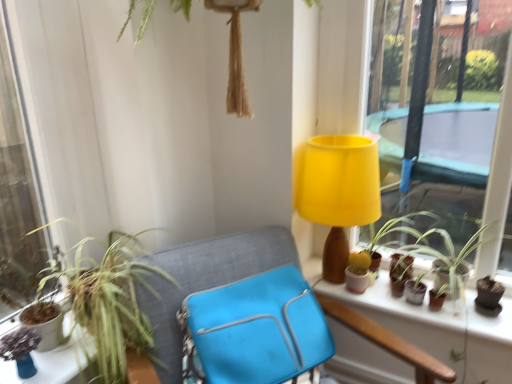
This screenshot has width=512, height=384. What do you see at coordinates (431, 250) in the screenshot? I see `green matte plant at right, the 1th houseplant positioned from the right` at bounding box center [431, 250].

Find the location of a particular element. The image size is (512, 384). matte green plant at lower left is located at coordinates (54, 362).

Image resolution: width=512 pixels, height=384 pixels. I want to click on matte brown flowerpot at right, which is the first flowerpot from right to left, so click(x=401, y=267).

What do you see at coordinates (339, 192) in the screenshot? The height and width of the screenshot is (384, 512). I see `yellow fabric lampshade at upper center` at bounding box center [339, 192].

Describe the element at coordinates (206, 280) in the screenshot. The height and width of the screenshot is (384, 512). I see `blue fabric bag at center` at that location.

Identify the location of blue fabric folding chair at center. This screenshot has height=384, width=512. (254, 330).

Find the location of `folding chair above the matte brown window sill at upper right (from a real-world perspective)`. folding chair above the matte brown window sill at upper right (from a real-world perspective) is located at coordinates (254, 330).

Which of these two, matte brown window sill at upper right or blue fabric folding chair at center, is bigger?

With larger size is blue fabric folding chair at center.

From a real-world perspective, does matte brown window sill at upper right stand above blue fabric folding chair at center?

No, from a real-world perspective, matte brown window sill at upper right is not above blue fabric folding chair at center.

Which of these two, matte brown window sill at upper right or blue fabric folding chair at center, stands taller?

blue fabric folding chair at center.

Is matte brown flowerpot at right, the 2th flowerpot from the left, wider than matte brown window sill at upper right?

In fact, matte brown flowerpot at right, the 2th flowerpot from the left, might be narrower than matte brown window sill at upper right.

From the image's perspective, is matte brown flowerpot at right, which is the first flowerpot from right to left, on top of matte brown window sill at upper right?

Yes, from the image's perspective, matte brown flowerpot at right, which is the first flowerpot from right to left, is above matte brown window sill at upper right.

Can you tell me how much matte brown flowerpot at right, which is the first flowerpot from right to left, and matte brown window sill at upper right differ in facing direction?

0.21 degrees separate the facing orientations of matte brown flowerpot at right, which is the first flowerpot from right to left, and matte brown window sill at upper right.

Considering the positions of point (394, 262) and point (438, 341), is point (394, 262) closer or farther from the camera than point (438, 341)?

Point (394, 262).

From a real-world perspective, is green leafy plant at left, placed as the 1th houseplant when sorted from left to right, above or below green matte plant at right, the 2th houseplant positioned from the left?

green leafy plant at left, placed as the 1th houseplant when sorted from left to right, is above green matte plant at right, the 2th houseplant positioned from the left.

Is the surface of green leafy plant at left, which is the second houseplant from right to left, in direct contact with green matte plant at right, the 2th houseplant positioned from the left?

They are not placed beside each other.

Is green leafy plant at left, which is the second houseplant from right to left, at the right side of green matte plant at right, the 1th houseplant positioned from the right?

No, green leafy plant at left, which is the second houseplant from right to left, is not to the right of green matte plant at right, the 1th houseplant positioned from the right.

The width and height of the screenshot is (512, 384). Find the location of `houseplant that is above the green matte plant at right, the 2th houseplant positioned from the left (from the image's perspective)`. houseplant that is above the green matte plant at right, the 2th houseplant positioned from the left (from the image's perspective) is located at coordinates (111, 301).

Is green leafy plant at left, placed as the 1th houseplant when sorted from left to right, next to matte white flowerpot at right, which is the first flowerpot in left-to-right order, and touching it?

No, green leafy plant at left, placed as the 1th houseplant when sorted from left to right, is not beside matte white flowerpot at right, which is the first flowerpot in left-to-right order.

From the image's perspective, does green leafy plant at left, which is the second houseplant from right to left, appear higher than matte white flowerpot at right, the 2th flowerpot when ordered from right to left?

Incorrect, from the image's perspective, green leafy plant at left, which is the second houseplant from right to left, is lower than matte white flowerpot at right, the 2th flowerpot when ordered from right to left.

Consider the image. Is green leafy plant at left, which is the second houseplant from right to left, in front of or behind matte white flowerpot at right, the 2th flowerpot when ordered from right to left, in the image?

In the image, green leafy plant at left, which is the second houseplant from right to left, appears in front of matte white flowerpot at right, the 2th flowerpot when ordered from right to left.

Would you say matte white flowerpot at right, which is the first flowerpot in left-to-right order, is part of green leafy plant at left, placed as the 1th houseplant when sorted from left to right,'s contents?

No, matte white flowerpot at right, which is the first flowerpot in left-to-right order, is not a part of green leafy plant at left, placed as the 1th houseplant when sorted from left to right.

Does matte brown window sill at upper right lie behind blue fabric bag at center?

Yes, matte brown window sill at upper right is behind blue fabric bag at center.

Between matte brown window sill at upper right and blue fabric bag at center, which one has larger width?

blue fabric bag at center is wider.

Is matte brown window sill at upper right shorter than blue fabric bag at center?

Yes, matte brown window sill at upper right is shorter than blue fabric bag at center.

Does point (359, 303) appear closer or farther from the camera than point (195, 276)?

Point (359, 303) appears to be farther away from the viewer than point (195, 276).

Is green leafy plant at left, which is the second houseplant from right to left, looking in the opposite direction of matte brown flowerpot at right, the 2th flowerpot from the left?

green leafy plant at left, which is the second houseplant from right to left, is not turned away from matte brown flowerpot at right, the 2th flowerpot from the left.

Consider the image. Which point is more forward, (x=76, y=291) or (x=404, y=260)?

The point (x=76, y=291) is in front.

Would you say green leafy plant at left, placed as the 1th houseplant when sorted from left to right, contains matte brown flowerpot at right, which is the first flowerpot from right to left?

That's incorrect, matte brown flowerpot at right, which is the first flowerpot from right to left, is not inside green leafy plant at left, placed as the 1th houseplant when sorted from left to right.

From the picture: Considering the sizes of objects green leafy plant at left, placed as the 1th houseplant when sorted from left to right, and matte brown flowerpot at right, which is the first flowerpot from right to left, in the image provided, who is wider, green leafy plant at left, placed as the 1th houseplant when sorted from left to right, or matte brown flowerpot at right, which is the first flowerpot from right to left,?

green leafy plant at left, placed as the 1th houseplant when sorted from left to right, is wider.

Considering the relative sizes of blue fabric folding chair at center and matte brown flowerpot at right, the 2th flowerpot from the left, in the image provided, is blue fabric folding chair at center wider than matte brown flowerpot at right, the 2th flowerpot from the left,?

Yes.

Looking at this image, could matte brown flowerpot at right, the 2th flowerpot from the left, be considered to be inside blue fabric folding chair at center?

Definitely not — matte brown flowerpot at right, the 2th flowerpot from the left, is not inside blue fabric folding chair at center.

From the image's perspective, which one is positioned higher, blue fabric folding chair at center or matte brown flowerpot at right, which is the first flowerpot from right to left?

matte brown flowerpot at right, which is the first flowerpot from right to left, appears higher in the image.

Which object is further away from the camera taking this photo, blue fabric folding chair at center or matte brown flowerpot at right, which is the first flowerpot from right to left?

matte brown flowerpot at right, which is the first flowerpot from right to left, is more distant.

Locate an element on the screen. This screenshot has width=512, height=384. window sill above the blue fabric folding chair at center (from the image's perspective) is located at coordinates (407, 318).

Locate an element on the screen. The width and height of the screenshot is (512, 384). window sill below the matte brown flowerpot at right, which is the first flowerpot from right to left (from the image's perspective) is located at coordinates (407, 318).

Estimate the real-world distances between objects in this image. Which object is further from matte white flowerpot at right, the 2th flowerpot when ordered from right to left, blue fabric bag at center or yellow fabric lampshade at upper center?

blue fabric bag at center is positioned further to the anchor matte white flowerpot at right, the 2th flowerpot when ordered from right to left.

From the image, which object appears to be farther from green matte plant at right, the 1th houseplant positioned from the right, matte brown flowerpot at right, the 2th flowerpot from the left, or green leafy plant at left, placed as the 1th houseplant when sorted from left to right?

Based on the image, green leafy plant at left, placed as the 1th houseplant when sorted from left to right, appears to be further to green matte plant at right, the 1th houseplant positioned from the right.

Estimate the real-world distances between objects in this image. Which object is further from yellow fabric lampshade at upper center, matte brown window sill at upper right or blue fabric bag at center?

The object further to yellow fabric lampshade at upper center is blue fabric bag at center.

Looking at the image, which one is located closer to green leafy plant at left, placed as the 1th houseplant when sorted from left to right, matte green plant at lower left or matte brown flowerpot at right, which is the first flowerpot from right to left?

The object closer to green leafy plant at left, placed as the 1th houseplant when sorted from left to right, is matte green plant at lower left.

Estimate the real-world distances between objects in this image. Which object is further from green leafy plant at left, placed as the 1th houseplant when sorted from left to right, matte green plant at lower left or yellow fabric lampshade at upper center?

Based on the image, yellow fabric lampshade at upper center appears to be further to green leafy plant at left, placed as the 1th houseplant when sorted from left to right.

Which object lies nearer to the anchor point yellow fabric lampshade at upper center, matte brown window sill at upper right or blue fabric folding chair at center?

Based on the image, matte brown window sill at upper right appears to be nearer to yellow fabric lampshade at upper center.

Considering their positions, is yellow fabric lampshade at upper center positioned further to matte green plant at lower left than blue fabric folding chair at center?

yellow fabric lampshade at upper center is further to matte green plant at lower left.

From the image, which object appears to be farther from matte white flowerpot at right, the 2th flowerpot when ordered from right to left, matte brown flowerpot at right, the 2th flowerpot from the left, or blue fabric bag at center?

Among the two, blue fabric bag at center is located further to matte white flowerpot at right, the 2th flowerpot when ordered from right to left.

What are the coordinates of `window sill between blue fabric folding chair at center and green matte plant at right, the 1th houseplant positioned from the right` in the screenshot? It's located at (407, 318).

This screenshot has height=384, width=512. I want to click on folding chair located between blue fabric bag at center and matte brown flowerpot at right, which is the first flowerpot from right to left, in the depth direction, so click(254, 330).

This screenshot has height=384, width=512. Identify the location of folding chair between matte green plant at lower left and matte white flowerpot at right, which is the first flowerpot in left-to-right order. (254, 330).

Find the location of a particular element. window sill between blue fabric folding chair at center and matte brown flowerpot at right, which is the first flowerpot from right to left is located at coordinates (407, 318).